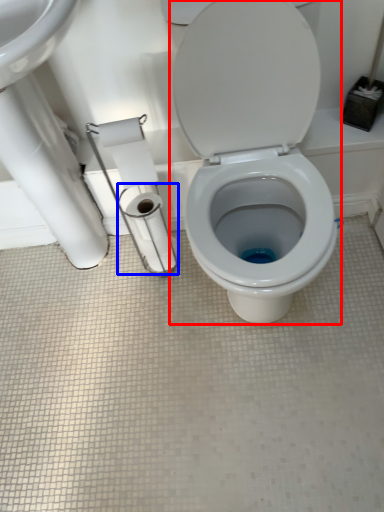
Question: Which point is closer to the camera, toilet (highlighted by a red box) or toilet paper (highlighted by a blue box)?

Choices:
 (A) toilet
 (B) toilet paper

Answer: (A)